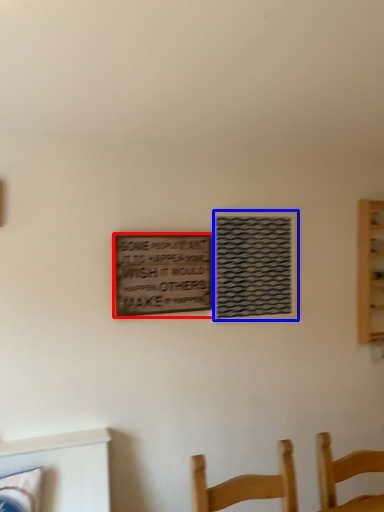
Question: Which of the following is the closest to the observer, plaque (highlighted by a red box) or window (highlighted by a blue box)?

Choices:
 (A) plaque
 (B) window

Answer: (A)